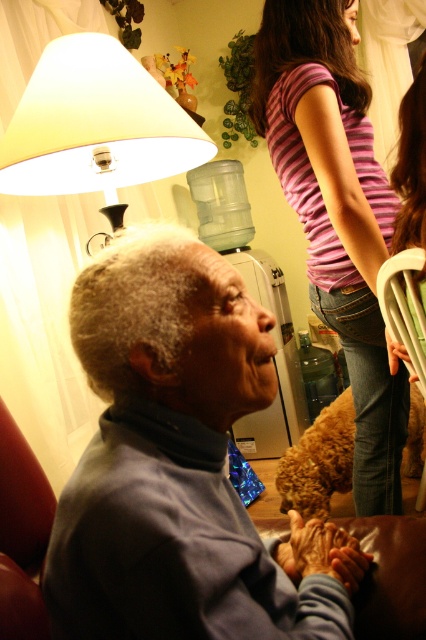
You are a photographer standing at the camera position. You want to capture a closeup shot of the gray fabric jacket at lower left. Is the jacket within your reach without moving the camera?

The gray fabric jacket at lower left is 45.81 centimeters away from the camera, so it is within reach for a closeup shot without moving the camera.

You are a delivery person who needs to place a small package between the white matte lampshade at upper left and the striped fabric shirt at upper center. The package is 70 centimeters long. Can you fit it between them?

The distance between the white matte lampshade at upper left and the striped fabric shirt at upper center is 69.26 centimeters. Since the package is 70 centimeters long, it cannot fit between them as it is slightly longer than the available space.